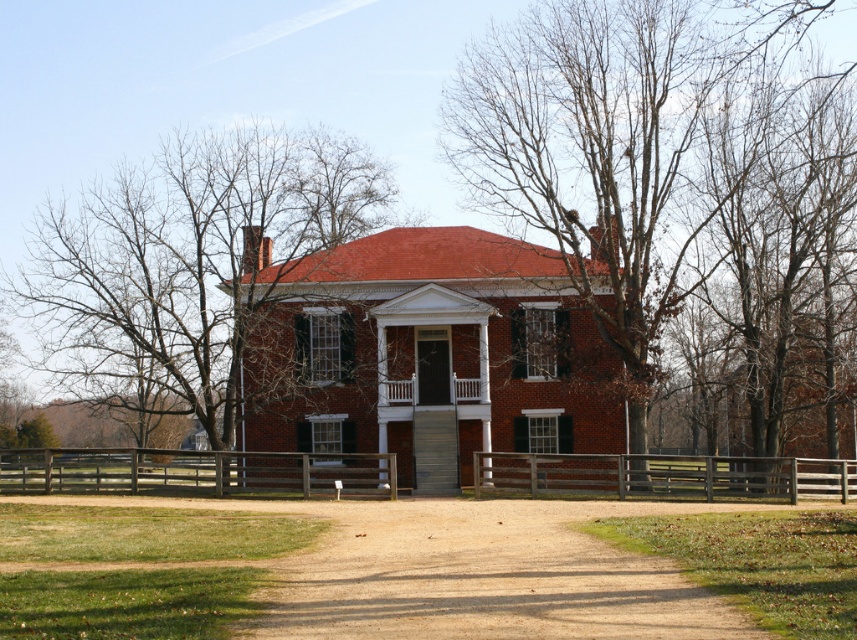
You are standing in front of the two story brick house and want to determine the relative positions of two points marked on the image. Which of the two points, point (790, 333) or point (267, 301), is closer to you?

Point (790, 333) is closer to the viewer than point (267, 301).

You are a painter standing on the dirt path leading to the house. You want to paint the bare branches at upper center and the brown wooden fence at lower center. Which object is taller?

The bare branches at upper center are taller than the brown wooden fence at lower center.

You are standing in front of the house and notice a point on the image. Can you describe what is located at point (658, 177)?

The point at (658, 177) indicates bare branches at upper center.